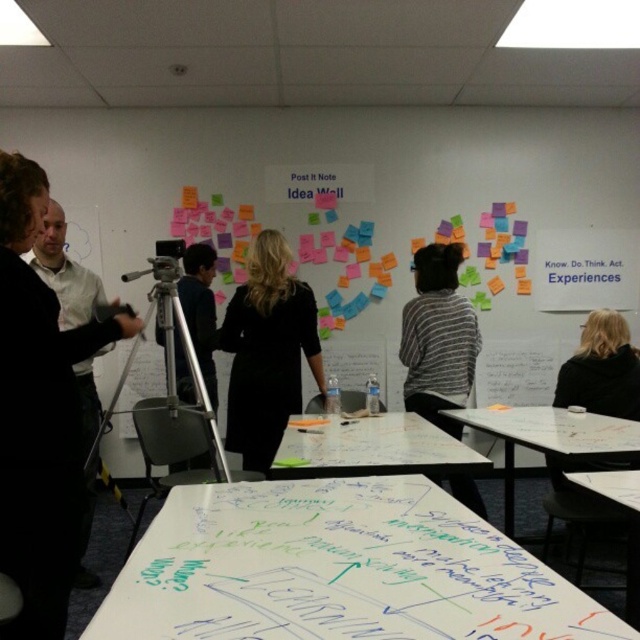
You are organizing a meeting in this room and need to place a large poster on the whiteboard paper at center and the white glossy table at center. Which surface will require you to fold the poster because it is smaller?

The whiteboard paper at center is shorter than the white glossy table at center, so the poster will need to be folded when placed on the whiteboard paper at center due to its smaller size.